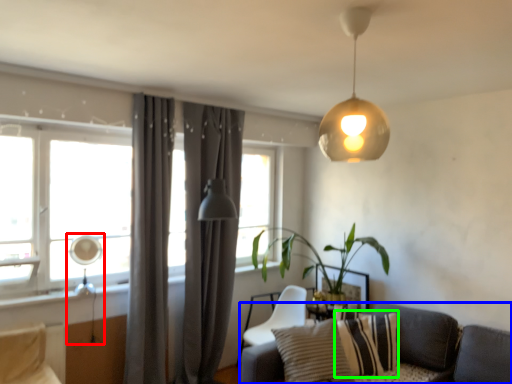
Question: Which object is positioned farthest from table lamp (highlighted by a red box)? Select from studio couch (highlighted by a blue box) and pillow (highlighted by a green box).

Choices:
 (A) studio couch
 (B) pillow

Answer: (A)